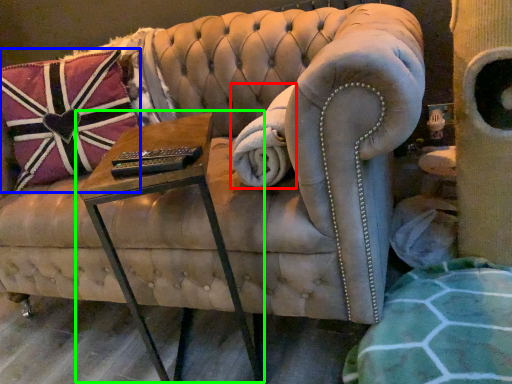
Question: Estimate the real-world distances between objects in this image. Which object is closer to blanket (highlighted by a red box), pillow (highlighted by a blue box) or table (highlighted by a green box)?

Choices:
 (A) pillow
 (B) table

Answer: (B)